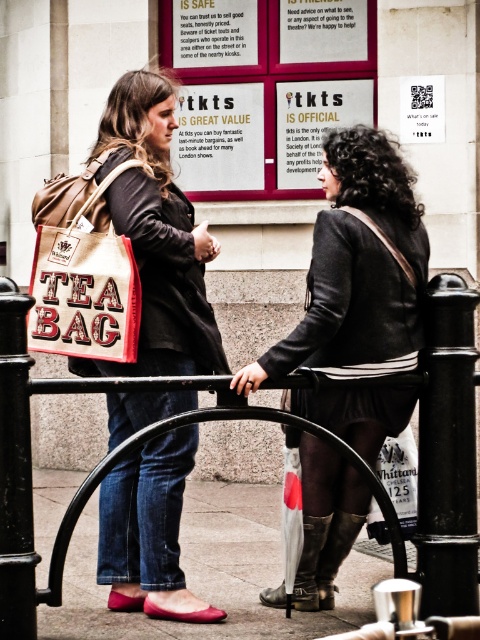
Question: Which object is positioned farthest from the matte black jacket at center?

Choices:
 (A) matte white sign at upper center
 (B) black metal pole at center
 (C) smooth concrete pavement at lower center

Answer: (A)

Question: Does matte black jacket at center have a smaller size compared to smooth concrete pavement at lower center?

Choices:
 (A) yes
 (B) no

Answer: (A)

Question: Which of these objects is positioned farthest from the matte white sign at upper center?

Choices:
 (A) matte brown tote bag at center
 (B) leather boots at lower center
 (C) leather boot at lower center
 (D) matte black jacket at center

Answer: (C)

Question: Considering the relative positions of beige canvas tea bag at center and matte paper sign at center in the image provided, where is beige canvas tea bag at center located with respect to matte paper sign at center?

Choices:
 (A) left
 (B) right

Answer: (A)

Question: Among these objects, which one is farthest from the camera?

Choices:
 (A) matte black jacket at center
 (B) matte brown tote bag at center
 (C) white paper bag at lower right
 (D) matte white sign at upper center

Answer: (D)

Question: Where is black metal rail at center located in relation to black metal pole at right in the image?

Choices:
 (A) right
 (B) left

Answer: (B)